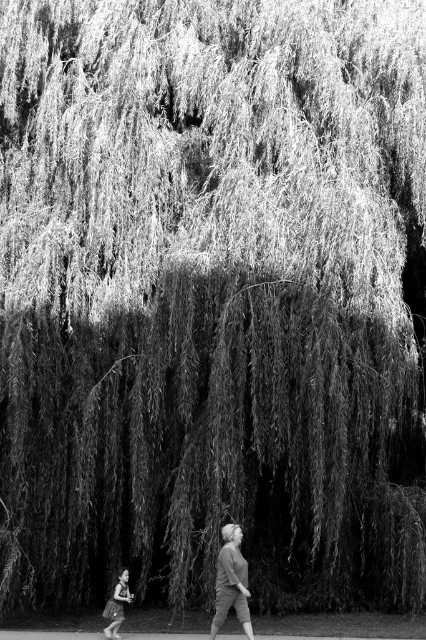
Which is below, matte gray sweater at center or smooth skin child at lower left?

smooth skin child at lower left

Does matte gray sweater at center have a lesser width compared to smooth skin child at lower left?

In fact, matte gray sweater at center might be wider than smooth skin child at lower left.

The image size is (426, 640). Identify the location of matte gray sweater at center. (230, 582).

Find the location of a particular element. The image size is (426, 640). matte gray sweater at center is located at coordinates (230, 582).